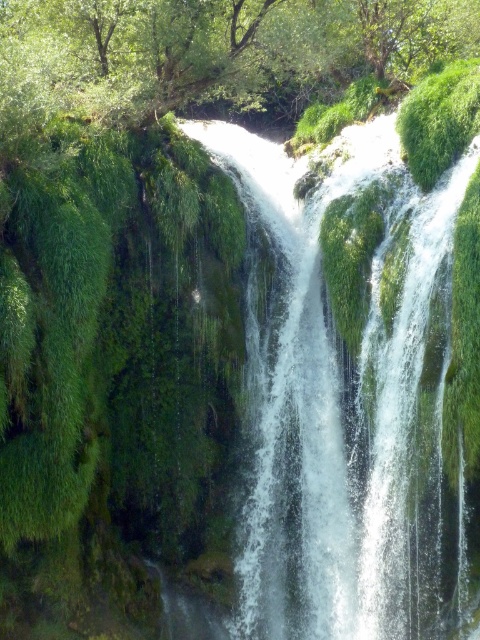
You are standing at the edge of the cliff looking down at the waterfall. You want to take a photo of the white frothy water at center. Where should you aim your camera to capture it in the frame?

You should aim your camera at point (339, 410) to capture the white frothy water at center in the frame.